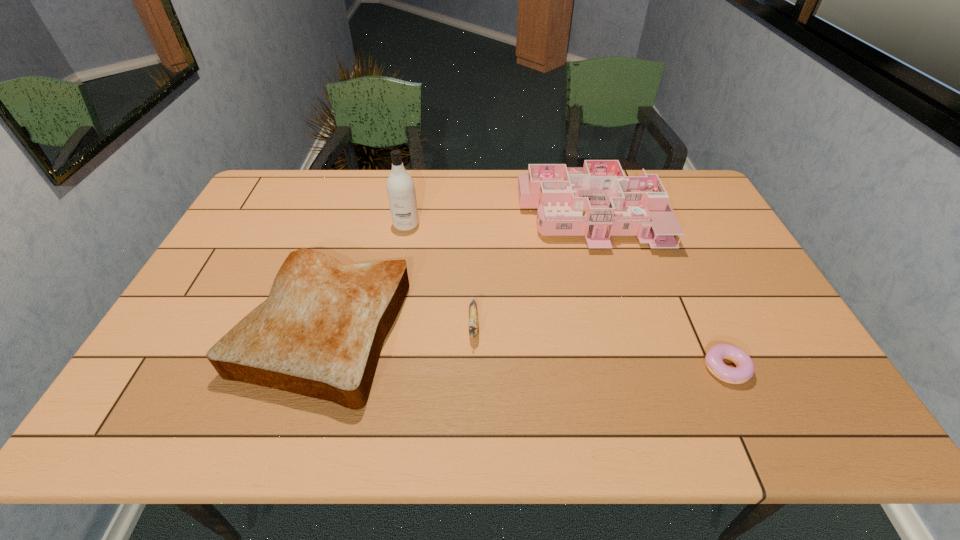
This screenshot has height=540, width=960. I want to click on the tallest object, so click(x=401, y=192).

Find the location of a particular element. the second tallest object is located at coordinates (598, 198).

At what (x,y) coordinates should I click in order to perform the action: click on the third shortest object. Please return your answer as a coordinate pair (x, y). The width and height of the screenshot is (960, 540). Looking at the image, I should click on (320, 332).

Identify the location of the fourth tallest object. This screenshot has height=540, width=960. (472, 314).

At what (x,y) coordinates should I click in order to perform the action: click on banana. Please return your answer as a coordinate pair (x, y). This screenshot has height=540, width=960. Looking at the image, I should click on (472, 314).

Locate an element on the screen. doughnut is located at coordinates (744, 370).

Image resolution: width=960 pixels, height=540 pixels. I want to click on vacant region located on the front-facing side of the shampoo, so (398, 266).

Image resolution: width=960 pixels, height=540 pixels. In order to click on free point located 0.340m at the front entrance of the dollhouse in this screenshot , I will do `click(627, 348)`.

At what (x,y) coordinates should I click in order to perform the action: click on free location located 0.130m on the back of the third shortest object. Please return your answer as a coordinate pair (x, y). Looking at the image, I should click on (351, 239).

Where is `vacant region located 0.070m on the peel of the third object from left to right`? vacant region located 0.070m on the peel of the third object from left to right is located at coordinates (473, 370).